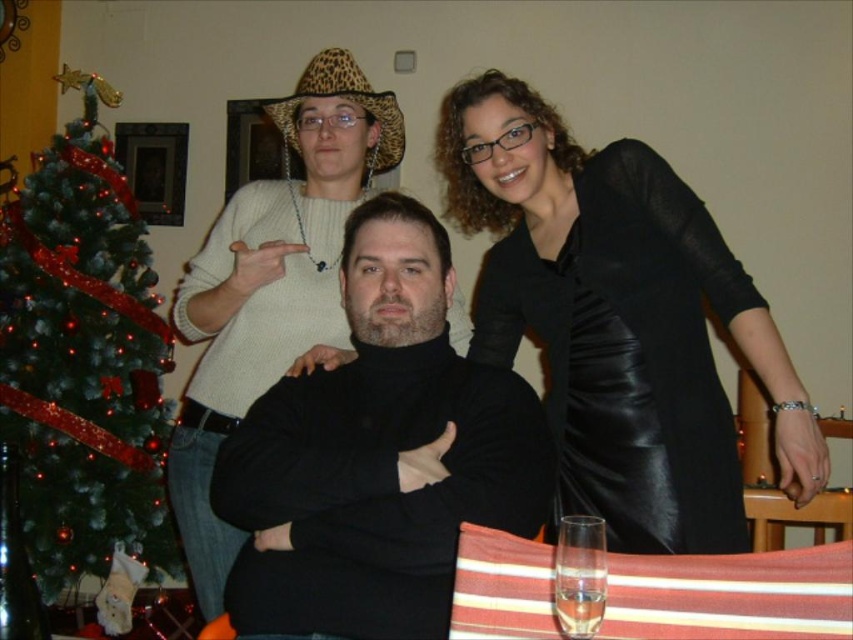
Question: Is black leather dress at upper right thinner than black turtleneck sweater at center?

Choices:
 (A) no
 (B) yes

Answer: (A)

Question: Estimate the real-world distances between objects in this image. Which object is farther from the green textured christmas tree at left?

Choices:
 (A) clear glass at lower right
 (B) black turtleneck sweater at center

Answer: (A)

Question: Which of these objects is positioned farthest from the green textured christmas tree at left?

Choices:
 (A) black leather dress at upper right
 (B) clear glass at lower right

Answer: (B)

Question: Which point is closer to the camera?

Choices:
 (A) green textured christmas tree at left
 (B) black leather dress at upper right

Answer: (B)

Question: Is black leather dress at upper right thinner than black turtleneck sweater at center?

Choices:
 (A) no
 (B) yes

Answer: (A)

Question: Can you confirm if green textured christmas tree at left is positioned below clear glass at lower right?

Choices:
 (A) no
 (B) yes

Answer: (A)